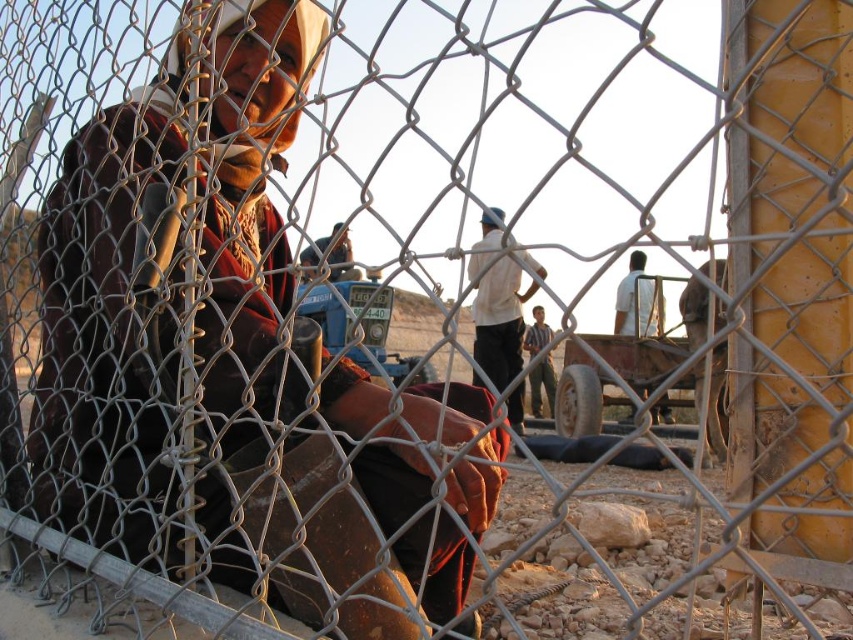
You are a security guard observing through the chain link fence. You notice two shirts at the center of the image. Which shirt is closer to you, the white cotton shirt at center or the striped fabric shirt at center?

The white cotton shirt at center is closer to you because it is in front of the striped fabric shirt at center.

You are standing in front of the chain link fence and see a point at coordinate (498, 321). What object is located at that point?

The white cotton shirt at center is located at point (498, 321).